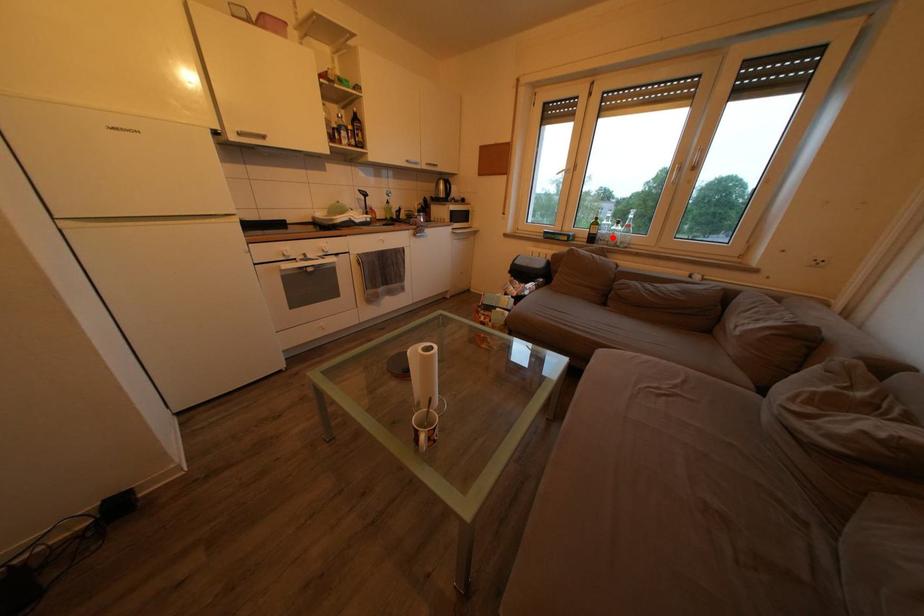
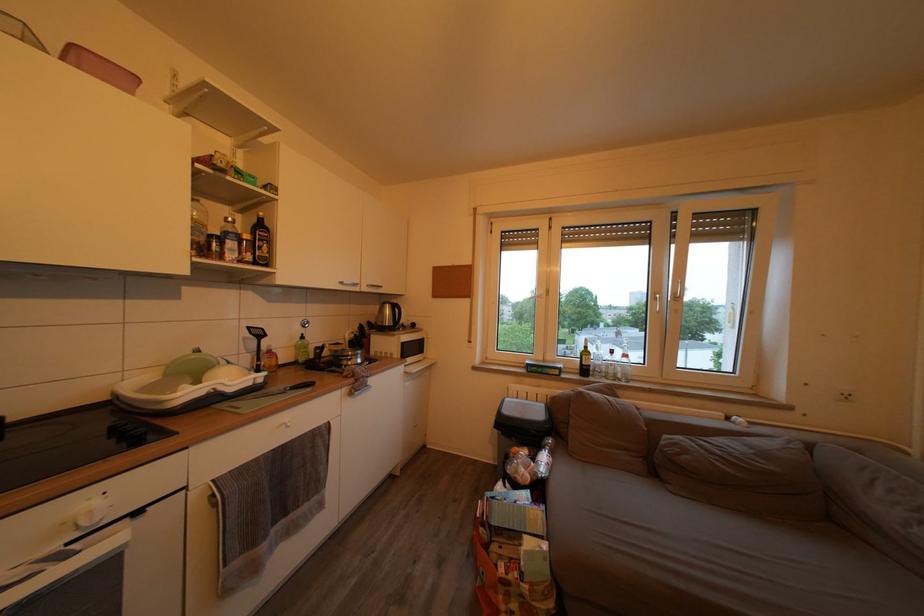
Question: I am providing you with two images of the same scene from different viewpoints. In image1, a red point is highlighted. Considering the same 3D point in image2, which of the following is correct?

Choices:
 (A) It is closer
 (B) It is farther

Answer: (B)